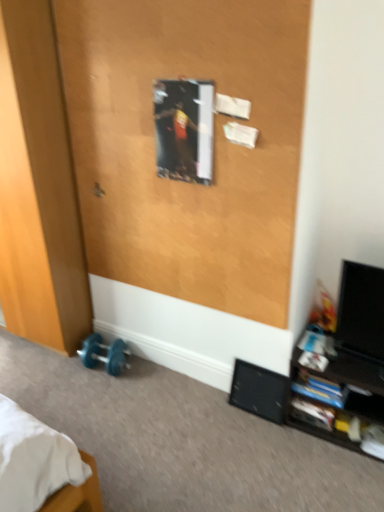
Where is `free point to the right of blue rubber dumbbell at lower left`? The width and height of the screenshot is (384, 512). free point to the right of blue rubber dumbbell at lower left is located at coordinates (145, 375).